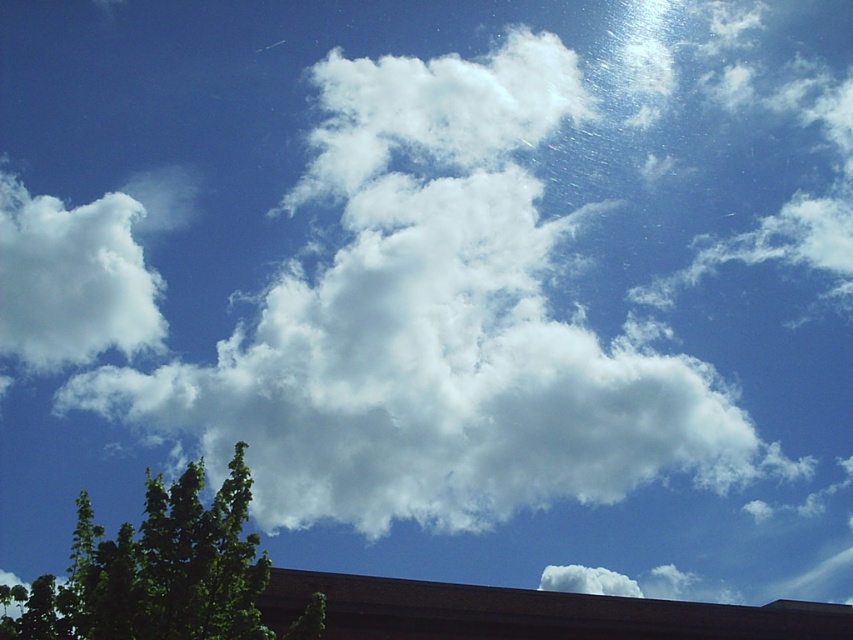
Does point (199, 544) come closer to viewer compared to point (36, 294)?

That is True.

Does point (138, 570) come behind point (51, 225)?

No, (138, 570) is closer to viewer.

At what (x,y) coordinates should I click in order to perform the action: click on green leafy tree at lower left. Please return your answer as a coordinate pair (x, y). Looking at the image, I should click on (154, 570).